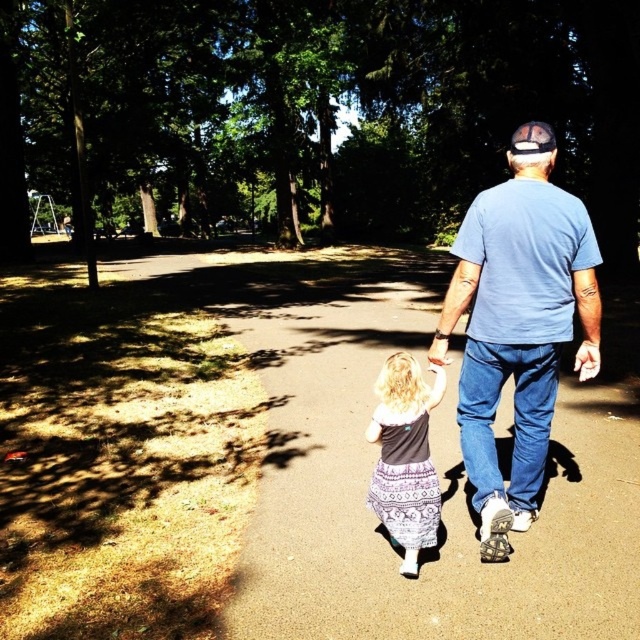
Question: Based on their relative distances, which object is nearer to the smooth asphalt path at center?

Choices:
 (A) patterned fabric dress at center
 (B) white fabric baseball cap at upper center

Answer: (A)

Question: Estimate the real-world distances between objects in this image. Which object is farther from the patterned fabric dress at center?

Choices:
 (A) white fabric baseball cap at upper center
 (B) blue cotton t-shirt at center

Answer: (A)

Question: Which of the following is the farthest from the observer?

Choices:
 (A) (360, 476)
 (B) (392, 400)
 (C) (534, 376)

Answer: (A)

Question: Does blue cotton t-shirt at center lie in front of patterned fabric dress at center?

Choices:
 (A) no
 (B) yes

Answer: (B)

Question: Does smooth asphalt path at center lie behind blue cotton t-shirt at center?

Choices:
 (A) yes
 (B) no

Answer: (B)

Question: Is smooth asphalt path at center to the left of patterned fabric dress at center from the viewer's perspective?

Choices:
 (A) no
 (B) yes

Answer: (A)